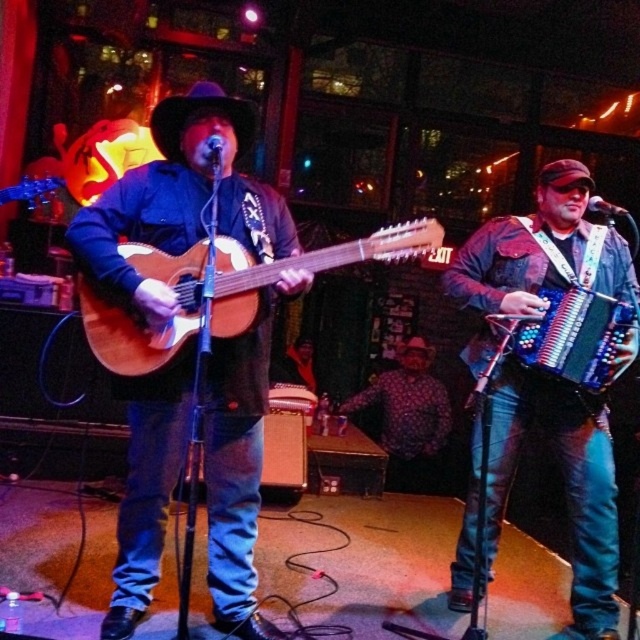
You are a photographer at the live music venue. You need to capture a photo of the blue denim jeans at right and the multicolored plastic accordion at right. Which object is positioned lower in the image?

The blue denim jeans at right is located below the multicolored plastic accordion at right, so it is positioned lower in the image.

You are a photographer at the live music performance. You need to capture a closeup shot of the matte wood guitar at center and the polka dot shirt at center. Since the camera can only focus on one object at a time, which object should you choose to ensure it appears larger in the photo?

The polka dot shirt at center is larger than the matte wood guitar at center, so to ensure the object appears larger in the photo, you should choose to focus on the polka dot shirt at center.